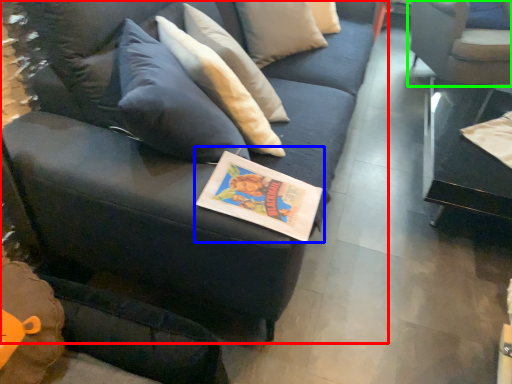
Question: Which object is the closest to the studio couch (highlighted by a red box)? Choose among these: book (highlighted by a blue box) or chair (highlighted by a green box).

Choices:
 (A) book
 (B) chair

Answer: (A)